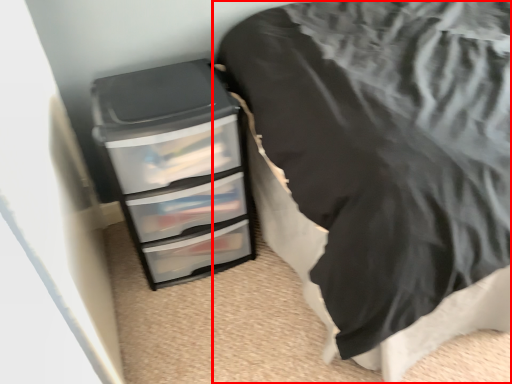
Question: In this image, where is furniture (annotated by the red box) located relative to chest of drawers?

Choices:
 (A) right
 (B) left

Answer: (A)